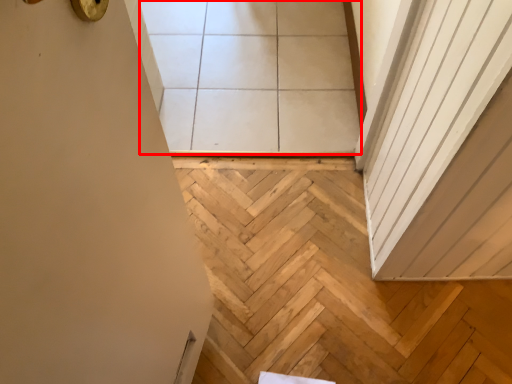
Question: From the image, what is the correct spatial relationship of tile (annotated by the red box) in relation to stairwell?

Choices:
 (A) left
 (B) right

Answer: (A)